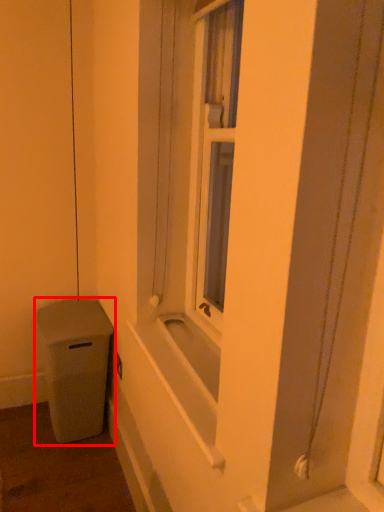
Question: Observing the image, what is the correct spatial positioning of waste container (annotated by the red box) in reference to bath?

Choices:
 (A) left
 (B) right

Answer: (A)